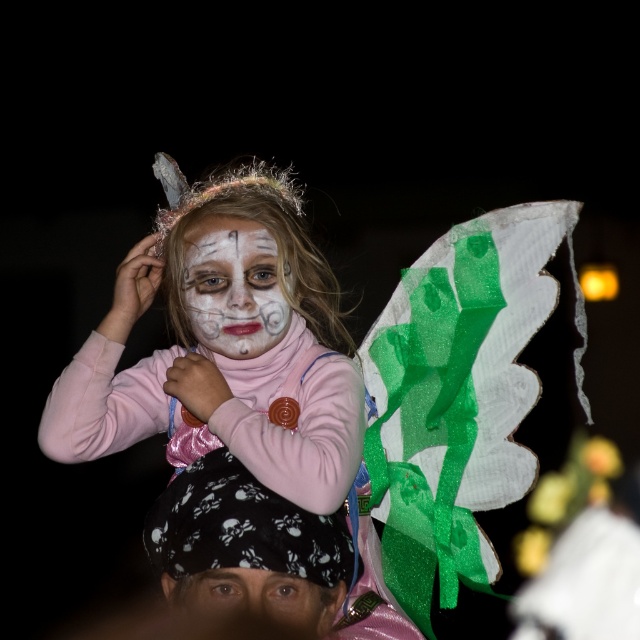
Question: Considering the relative positions of matte pink sweater at center and white matte face paint at center in the image provided, where is matte pink sweater at center located with respect to white matte face paint at center?

Choices:
 (A) below
 (B) above

Answer: (A)

Question: Estimate the real-world distances between objects in this image. Which object is closer to the white matte face paint at center?

Choices:
 (A) matte pink sweater at center
 (B) smooth skin eyes at center

Answer: (A)

Question: Is white matte face paint at center to the left of smooth skin eyes at center from the viewer's perspective?

Choices:
 (A) no
 (B) yes

Answer: (B)

Question: Considering the real-world distances, which object is farthest from the matte pink sweater at center?

Choices:
 (A) white matte face paint at center
 (B) smooth skin eyes at center

Answer: (B)

Question: From the image, what is the correct spatial relationship of white matte face paint at center in relation to smooth skin eyes at center?

Choices:
 (A) left
 (B) right

Answer: (A)

Question: Among these points, which one is farthest from the camera?

Choices:
 (A) (102, 332)
 (B) (314, 588)

Answer: (A)